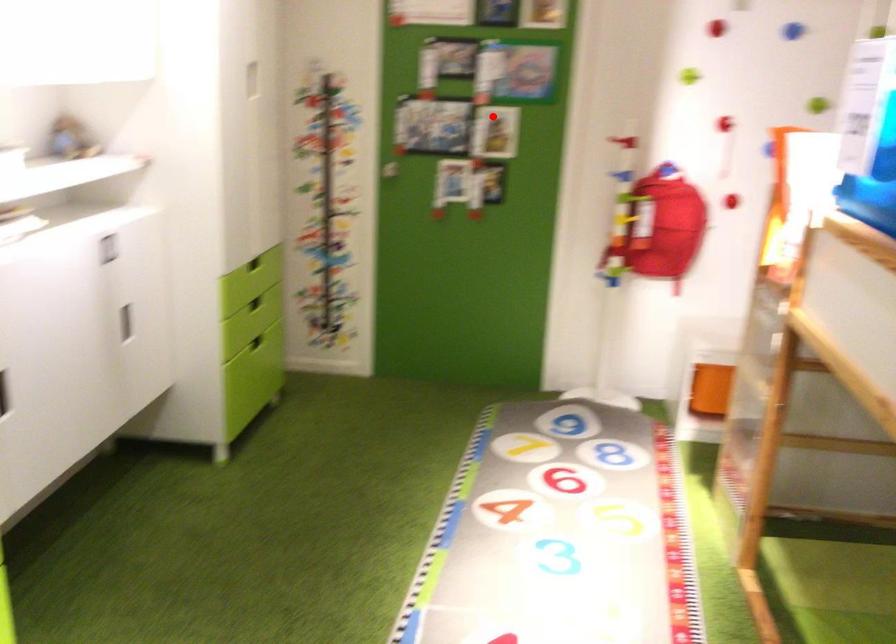
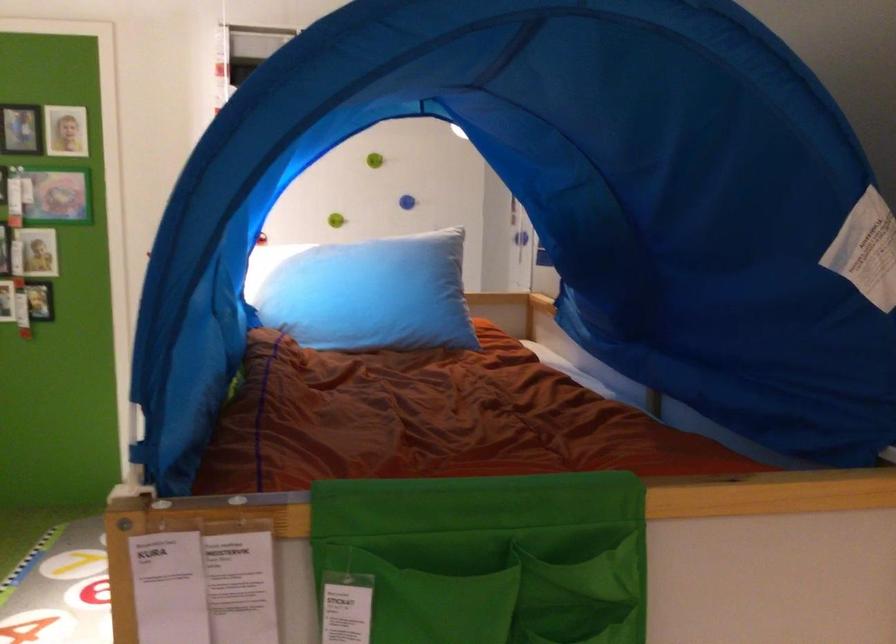
In the second image, find the point that corresponds to the highlighted location in the first image.

(39, 251)